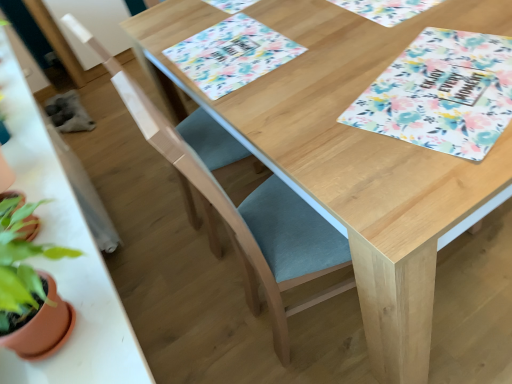
Find the location of a particular element. vacant space that's between floral fabric placemat at upper right and floral paper placemat at center, the first place mat viewed from the left is located at coordinates (334, 71).